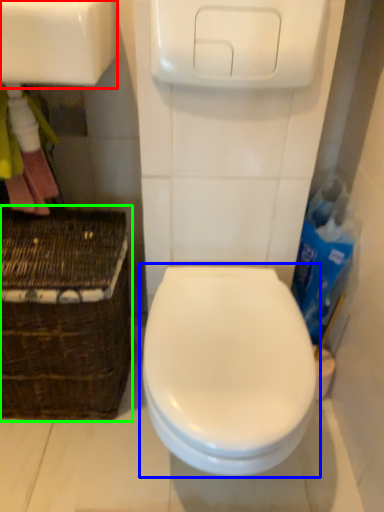
Question: Which object is the farthest from sink (highlighted by a red box)? Choose among these: toilet (highlighted by a blue box) or basket (highlighted by a green box).

Choices:
 (A) toilet
 (B) basket

Answer: (A)